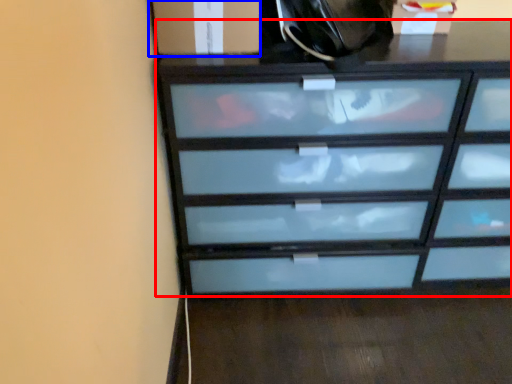
Question: Which object is further to the camera taking this photo, chest of drawers (highlighted by a red box) or cabinetry (highlighted by a blue box)?

Choices:
 (A) chest of drawers
 (B) cabinetry

Answer: (B)